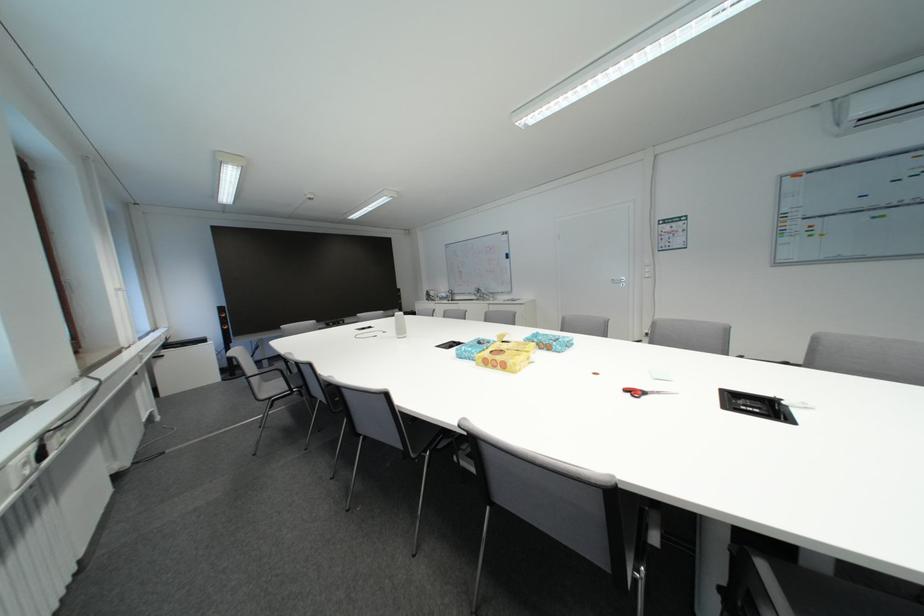
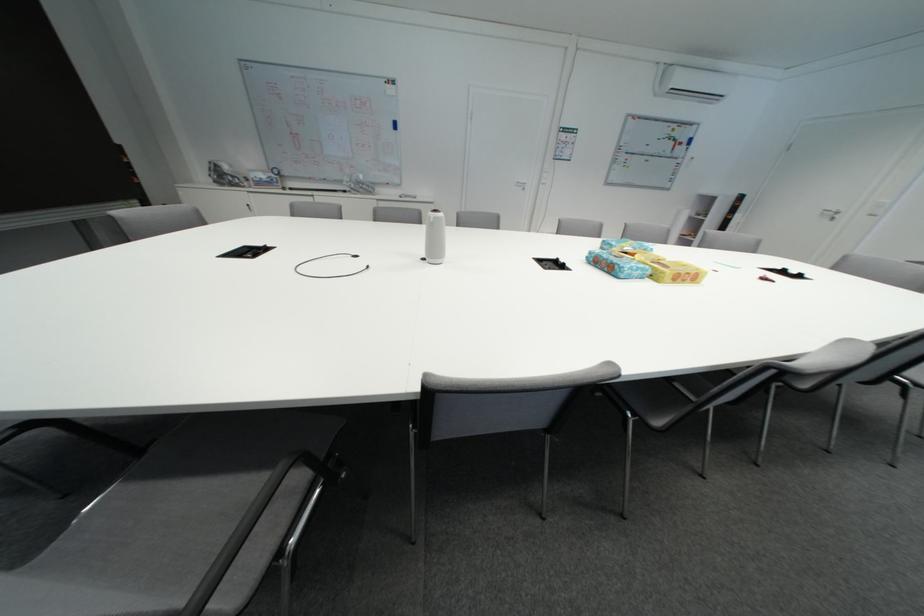
Question: I am providing you with two images of the same scene from different viewpoints. Which of the following objects are not visible in image2?

Choices:
 (A) red marker
 (B) yellow tissue box
 (C) white cylindrical speaker
 (D) none of these

Answer: (D)